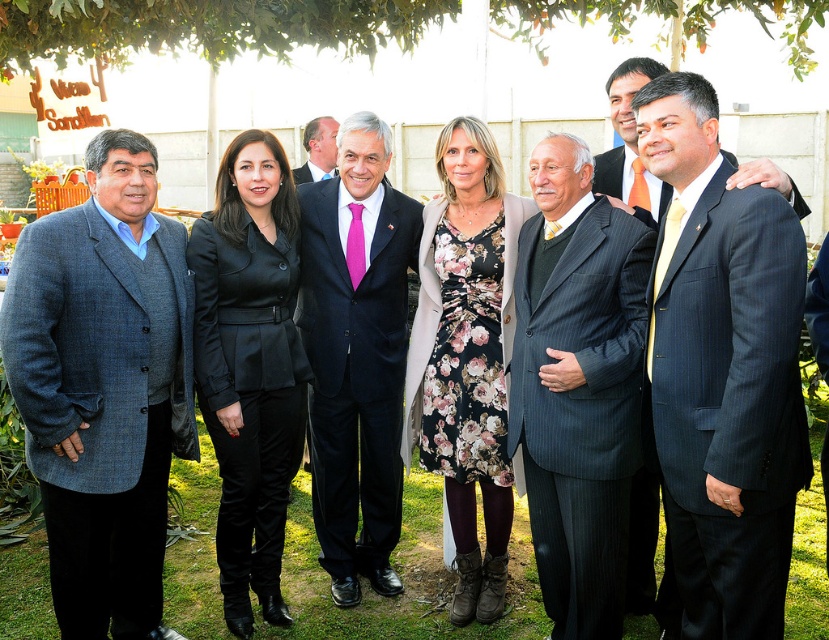
Is gray woolen blazer at left further to the viewer compared to gray pinstripe suit at center?

No, it is not.

Can you confirm if gray woolen blazer at left is taller than gray pinstripe suit at center?

Yes.

Is point (91, 413) closer to camera compared to point (531, 508)?

Yes, point (91, 413) is closer to viewer.

At what (x,y) coordinates should I click in order to perform the action: click on gray woolen blazer at left. Please return your answer as a coordinate pair (x, y). Image resolution: width=829 pixels, height=640 pixels. Looking at the image, I should click on (104, 387).

Who is shorter, dark blue pinstripe suit at right or matte black suit at center?

matte black suit at center

How distant is dark blue pinstripe suit at right from matte black suit at center?

3.64 feet

Is point (745, 566) farther from viewer compared to point (616, 113)?

No, (745, 566) is in front of (616, 113).

You are a GUI agent. You are given a task and a screenshot of the screen. Output one action in this format:
    pyautogui.click(x=<x>, y=<y>)
    Task: Click on the dark blue pinstripe suit at right
    The width and height of the screenshot is (829, 640).
    Given the screenshot: What is the action you would take?
    pyautogui.click(x=730, y=403)

Is dark blue suit at center above matte black suit at center?

No, dark blue suit at center is not above matte black suit at center.

Is point (318, 419) in front of point (739, 170)?

No, it is behind (739, 170).

Image resolution: width=829 pixels, height=640 pixels. I want to click on dark blue suit at center, so click(x=356, y=353).